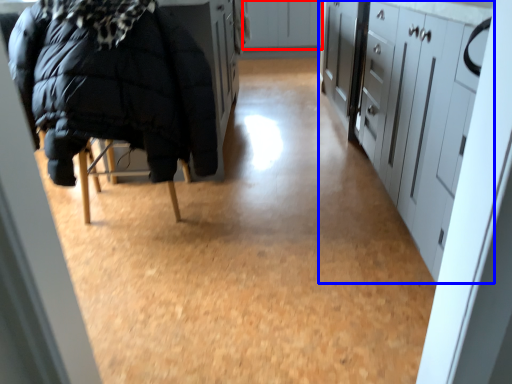
Question: Which object is further to the camera taking this photo, cabinetry (highlighted by a red box) or cabinetry (highlighted by a blue box)?

Choices:
 (A) cabinetry
 (B) cabinetry

Answer: (A)